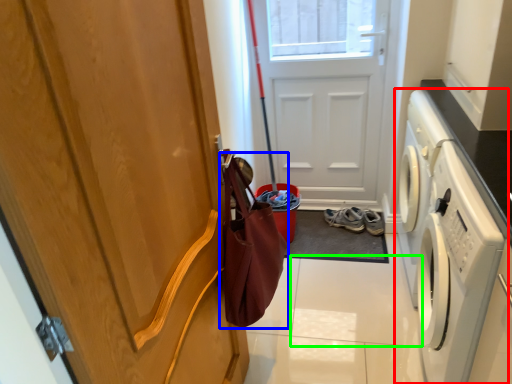
Question: Which object is the farthest from washing machine (highlighted by a red box)? Choose among these: shopping bag (highlighted by a blue box) or tile (highlighted by a green box).

Choices:
 (A) shopping bag
 (B) tile

Answer: (A)